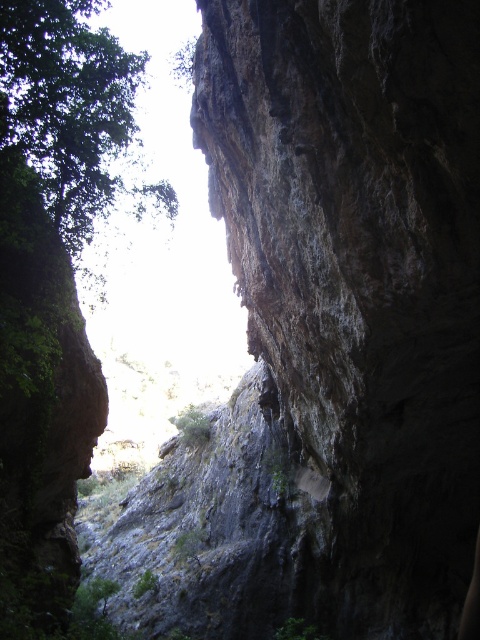
You are a hiker looking at the dark brown rocky cliff at upper right and the green leafy tree at upper left. Which object is higher in the scene?

The dark brown rocky cliff at upper right is taller than the green leafy tree at upper left.

In the scene shown: You are a hiker standing at the bottom of the canyon looking up. There are two points marked in the image. Which point, point (348, 605) or point (80, 70), is closer to you?

Point (348, 605) is closer to the camera than point (80, 70), so the point closer to you is point (348, 605).